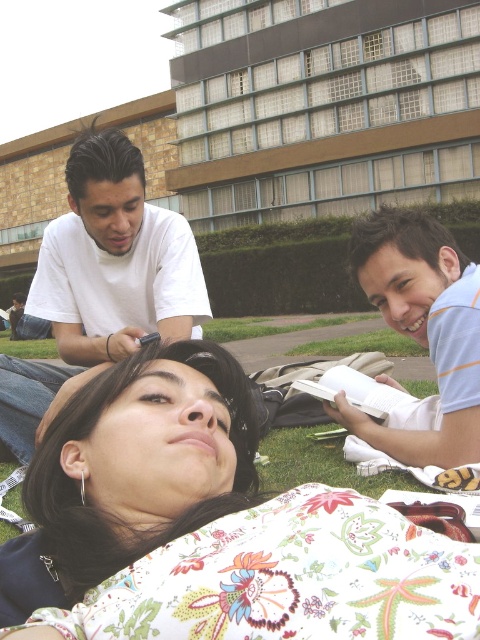
Can you confirm if floral fabric pillow at lower center is positioned above light blue striped shirt at lower right?

No, floral fabric pillow at lower center is not above light blue striped shirt at lower right.

Can you confirm if floral fabric pillow at lower center is wider than light blue striped shirt at lower right?

Correct, the width of floral fabric pillow at lower center exceeds that of light blue striped shirt at lower right.

Is point (216, 513) closer to camera compared to point (467, 394)?

Yes.

Find the location of a particular element. Image resolution: width=480 pixels, height=640 pixels. floral fabric pillow at lower center is located at coordinates (104, 509).

Is floral cotton blanket at lower center smaller than white matte shirt at upper left?

Indeed, floral cotton blanket at lower center has a smaller size compared to white matte shirt at upper left.

Is point (338, 630) more distant than point (179, 321)?

That is False.

Is point (164, 556) positioned behind point (119, 257)?

No, (164, 556) is in front of (119, 257).

What are the coordinates of `floral cotton blanket at lower center` in the screenshot? It's located at (289, 579).

Does white matte shirt at upper left have a lesser height compared to light blue striped shirt at lower right?

No.

Can you confirm if white matte shirt at upper left is bigger than light blue striped shirt at lower right?

Yes.

Is point (86, 227) positioned behind point (404, 248)?

Yes, it is.

Locate an element on the screen. The height and width of the screenshot is (640, 480). white matte shirt at upper left is located at coordinates (115, 259).